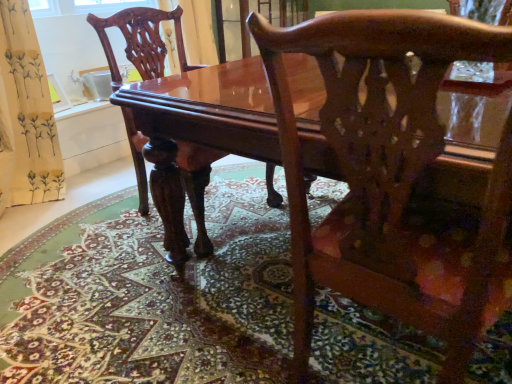
Question: Is glossy wood chair at center, acting as the first chair starting from the front, wider than glossy wood chair at center, placed as the first chair when sorted from back to front?

Choices:
 (A) no
 (B) yes

Answer: (A)

Question: From the image's perspective, is glossy wood chair at center, which ranks as the 1th chair in right-to-left order, below glossy wood chair at center, placed as the first chair when sorted from back to front?

Choices:
 (A) yes
 (B) no

Answer: (A)

Question: Would you say glossy wood chair at center, arranged as the 2th chair when viewed from the left, is a long distance from glossy wood chair at center, placed as the first chair when sorted from back to front?

Choices:
 (A) no
 (B) yes

Answer: (A)

Question: Is glossy wood chair at center, placed as the 2th chair when sorted from front to back, surrounded by glossy wood chair at center, which ranks as the 1th chair in right-to-left order?

Choices:
 (A) yes
 (B) no

Answer: (B)

Question: Considering the relative positions of glossy wood chair at center, which is the second chair in back-to-front order, and glossy wood chair at center, placed as the first chair when sorted from back to front, in the image provided, is glossy wood chair at center, which is the second chair in back-to-front order, to the right of glossy wood chair at center, placed as the first chair when sorted from back to front, from the viewer's perspective?

Choices:
 (A) yes
 (B) no

Answer: (A)

Question: Considering the positions of glossy wood chair at center, which is the first chair in left-to-right order, and glossy wood chair at center, which is the second chair in back-to-front order, in the image, is glossy wood chair at center, which is the first chair in left-to-right order, bigger or smaller than glossy wood chair at center, which is the second chair in back-to-front order,?

Choices:
 (A) small
 (B) big

Answer: (B)

Question: Would you say glossy wood chair at center, placed as the 2th chair when sorted from front to back, is inside or outside glossy wood chair at center, acting as the first chair starting from the front?

Choices:
 (A) inside
 (B) outside

Answer: (B)

Question: In the image, is glossy wood chair at center, which is the first chair in left-to-right order, on the left side or the right side of glossy wood chair at center, which is the second chair in back-to-front order?

Choices:
 (A) right
 (B) left

Answer: (B)

Question: From the image's perspective, is glossy wood chair at center, which is the first chair in left-to-right order, above or below glossy wood chair at center, arranged as the 2th chair when viewed from the left?

Choices:
 (A) above
 (B) below

Answer: (A)

Question: Considering the positions of glossy wood table at center and glossy wood chair at center, acting as the first chair starting from the front, in the image, is glossy wood table at center taller or shorter than glossy wood chair at center, acting as the first chair starting from the front,?

Choices:
 (A) tall
 (B) short

Answer: (B)

Question: Choose the correct answer: Is glossy wood table at center inside glossy wood chair at center, arranged as the 2th chair when viewed from the left, or outside it?

Choices:
 (A) inside
 (B) outside

Answer: (B)

Question: Is point (194, 92) positioned closer to the camera than point (492, 253)?

Choices:
 (A) farther
 (B) closer

Answer: (A)

Question: Visually, is glossy wood table at center positioned to the left or to the right of glossy wood chair at center, acting as the first chair starting from the front?

Choices:
 (A) left
 (B) right

Answer: (A)

Question: From the image's perspective, is glossy wood chair at center, arranged as the 2th chair when viewed from the left, positioned above or below carpeted floor at center?

Choices:
 (A) above
 (B) below

Answer: (A)

Question: Would you say glossy wood chair at center, acting as the first chair starting from the front, is to the left or to the right of carpeted floor at center in the picture?

Choices:
 (A) right
 (B) left

Answer: (A)